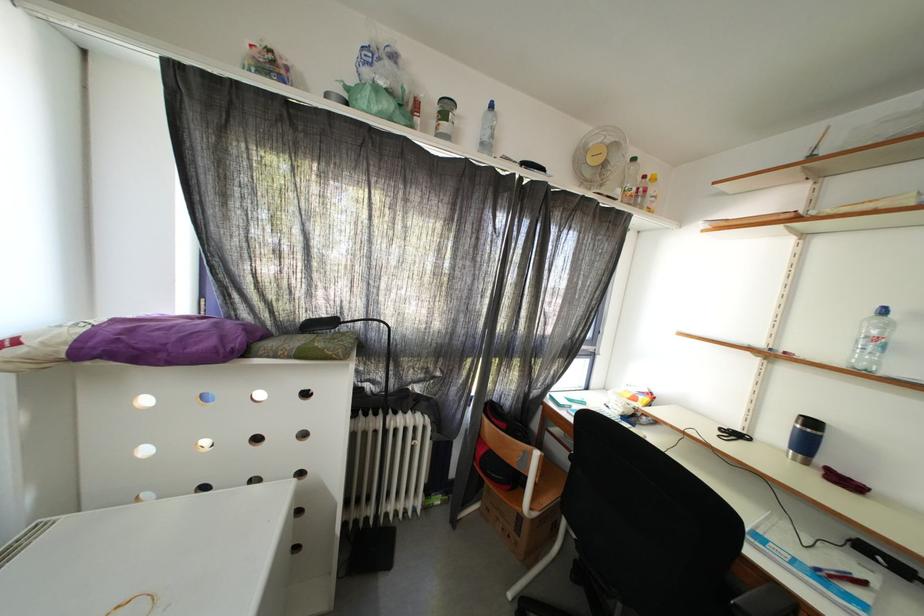
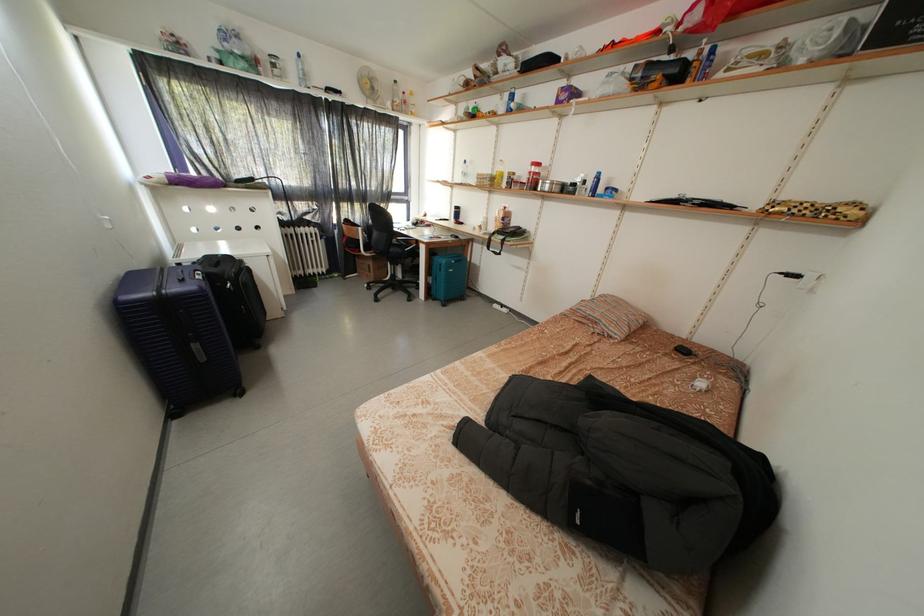
Locate, in the second image, the point that corresponds to (311,322) in the first image.

(242, 182)